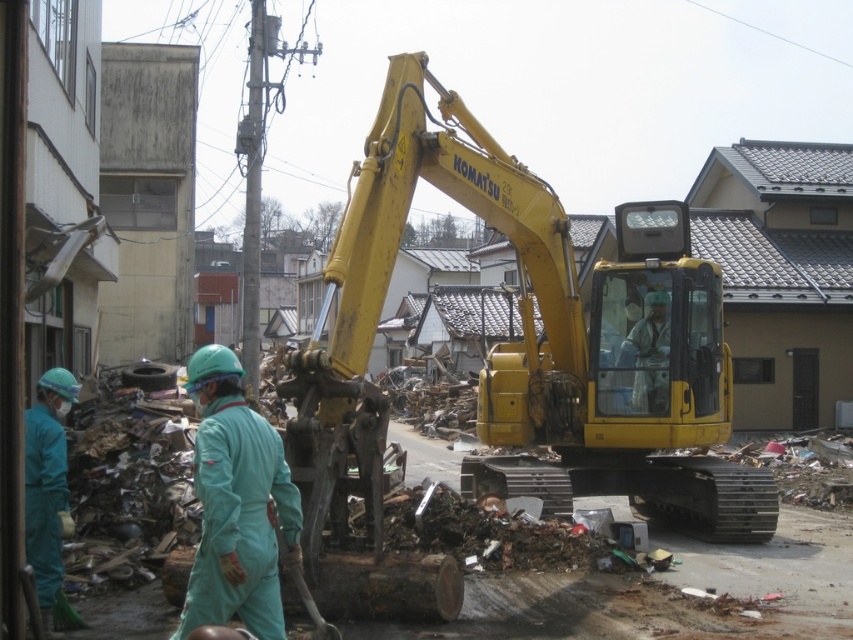
Question: Considering the relative positions of yellow metallic excavator at center and light blue fabric at center in the image provided, where is yellow metallic excavator at center located with respect to light blue fabric at center?

Choices:
 (A) right
 (B) left

Answer: (B)

Question: Based on their relative distances, which object is nearer to the yellow metallic excavator at center?

Choices:
 (A) teal fabric uniform at left
 (B) light blue fabric at center
 (C) teal fabric jumpsuit at center

Answer: (B)

Question: Can you confirm if teal fabric jumpsuit at center is bigger than teal fabric uniform at left?

Choices:
 (A) no
 (B) yes

Answer: (A)

Question: Can you confirm if yellow metallic excavator at center is positioned above teal fabric jumpsuit at center?

Choices:
 (A) no
 (B) yes

Answer: (A)

Question: Which object appears closest to the camera in this image?

Choices:
 (A) yellow metallic excavator at center
 (B) teal fabric uniform at left
 (C) teal fabric jumpsuit at center
 (D) light blue fabric at center

Answer: (C)

Question: Among these points, which one is farthest from the camera?

Choices:
 (A) (630, 314)
 (B) (469, 467)

Answer: (B)